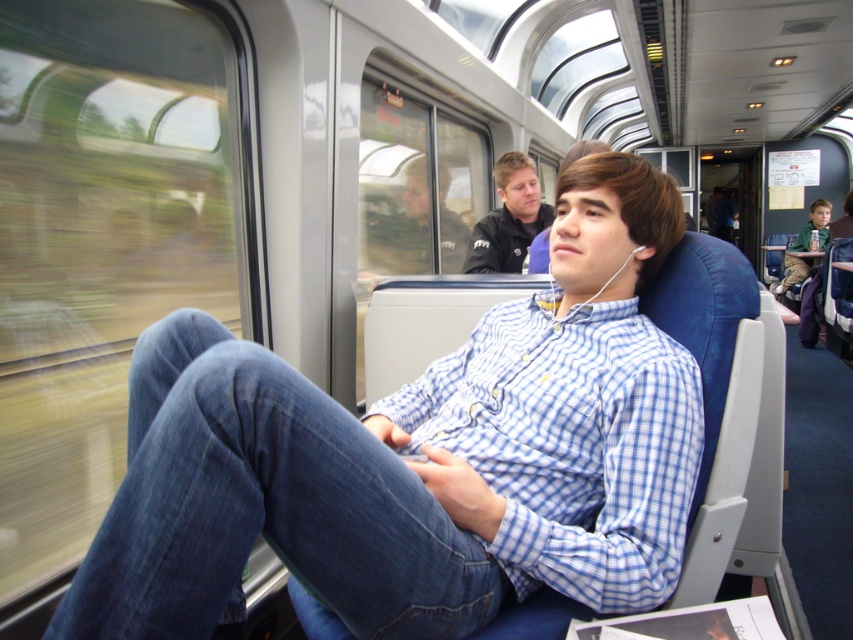
From the picture: Is matte black jacket at center below dark blue jacket at upper center?

Actually, matte black jacket at center is above dark blue jacket at upper center.

The image size is (853, 640). Find the location of `matte black jacket at center`. matte black jacket at center is located at coordinates coord(402,227).

Is point (312, 467) positioned after point (421, 154)?

No, it is in front of (421, 154).

Can you confirm if denim at left is wider than matte black jacket at center?

Yes, denim at left is wider than matte black jacket at center.

The height and width of the screenshot is (640, 853). Find the location of `denim at left`. denim at left is located at coordinates (264, 506).

You are a GUI agent. You are given a task and a screenshot of the screen. Output one action in this format:
    pyautogui.click(x=<x>, y=<y>)
    Task: Click on the denim at left
    
    Given the screenshot: What is the action you would take?
    pyautogui.click(x=264, y=506)

Which is below, denim at left or dark blue jacket at upper center?

denim at left is lower down.

Who is higher up, denim at left or dark blue jacket at upper center?

Positioned higher is dark blue jacket at upper center.

Between point (225, 528) and point (490, 218), which one is positioned behind?

The point (490, 218) is behind.

This screenshot has width=853, height=640. Identify the location of denim at left. point(264,506).